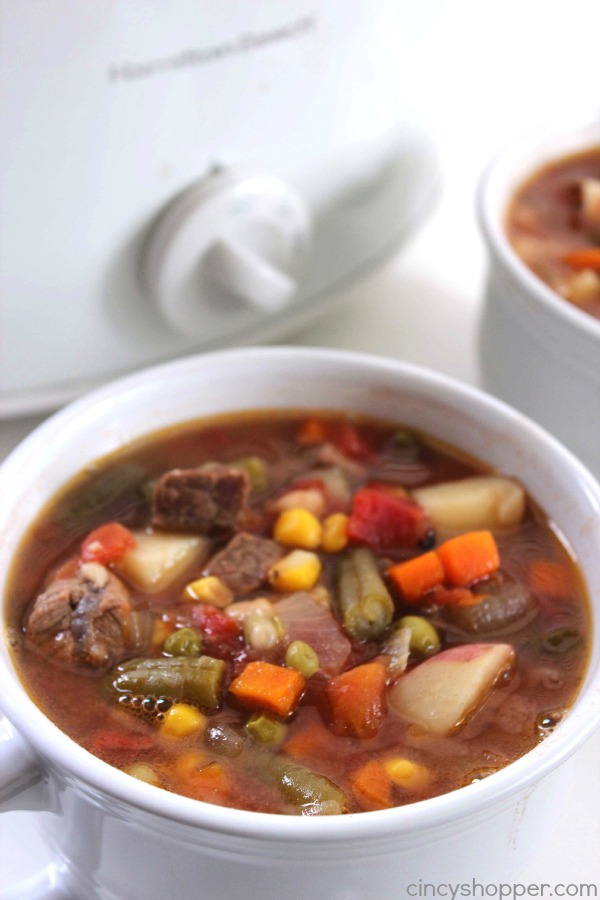
Find the location of a particular element. shadow of bowl is located at coordinates (509, 366).